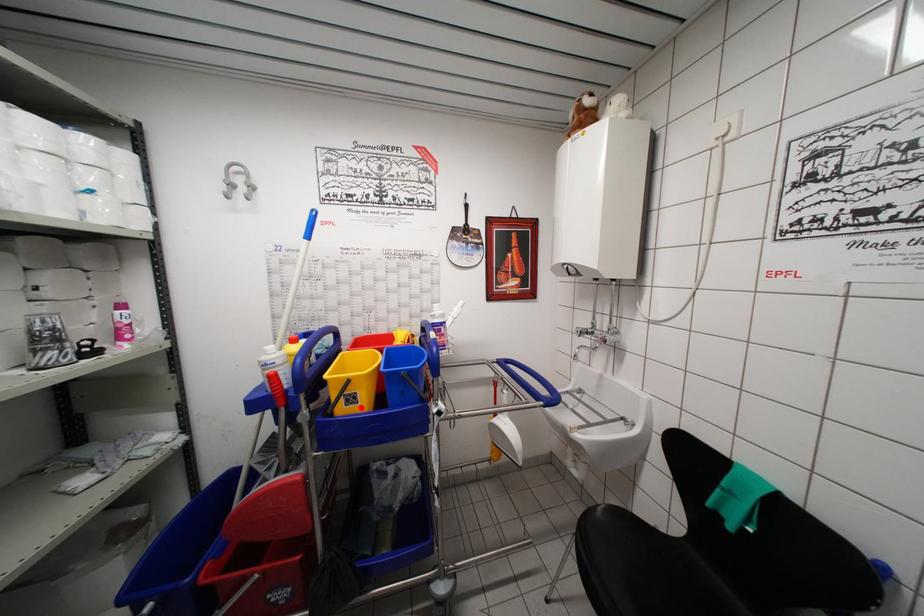
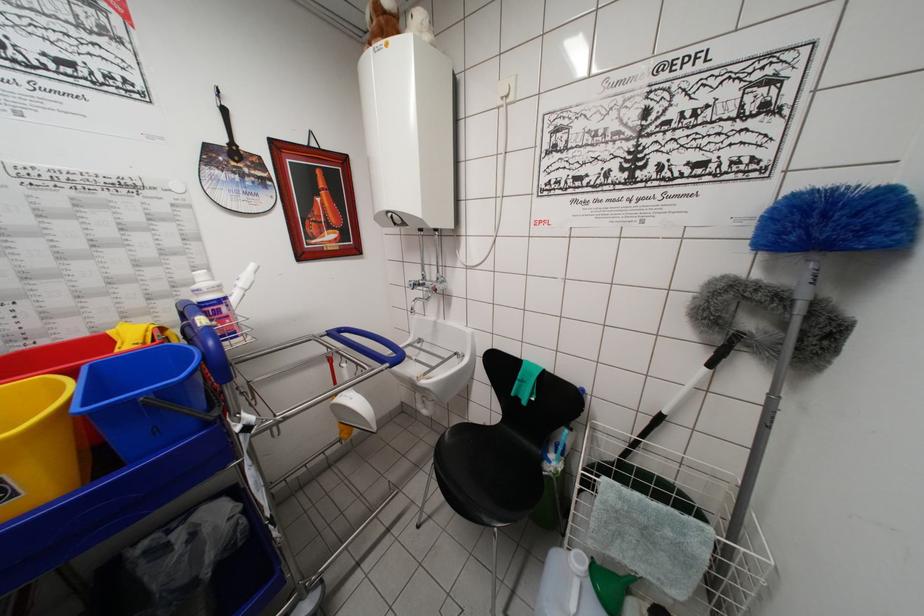
Question: I am providing you with two images of the same scene from different viewpoints. Given a red point in image1, look at the same physical point in image2. Is it:

Choices:
 (A) Closer to the viewpoint
 (B) Farther from the viewpoint

Answer: (B)